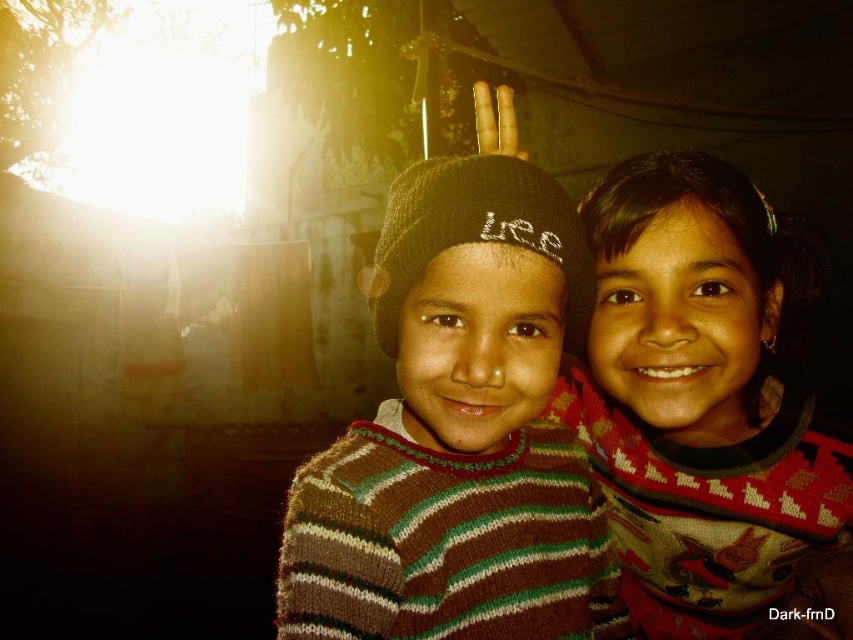
You are a photographer trying to capture both children in a single shot. Since the knitted striped sweater at center and the knitted sweater at center are both at the center, which one is closer to the camera?

The knitted striped sweater at center is positioned under knitted sweater at center, so the knitted sweater at center is closer to the camera.

From the picture: You are a photographer setting up a photo shoot for two children wearing the knitted striped sweater at center and the knitted sweater at center. You need to arrange them so that the shorter sweater is positioned in front to avoid being blocked by the taller one. Which sweater should be placed in front?

The knitted striped sweater at center should be placed in front because it is shorter than the knitted sweater at center, so it won

Looking at this image, you are a photographer trying to capture a closeup of the knitted striped sweater at center. Based on the coordinates provided, can you determine if the sweater is positioned towards the left or right side of the image?

The knitted striped sweater at center is positioned at coordinates point (459, 433), which places it closer to the right side of the image since the x coordinate is above 0.5.